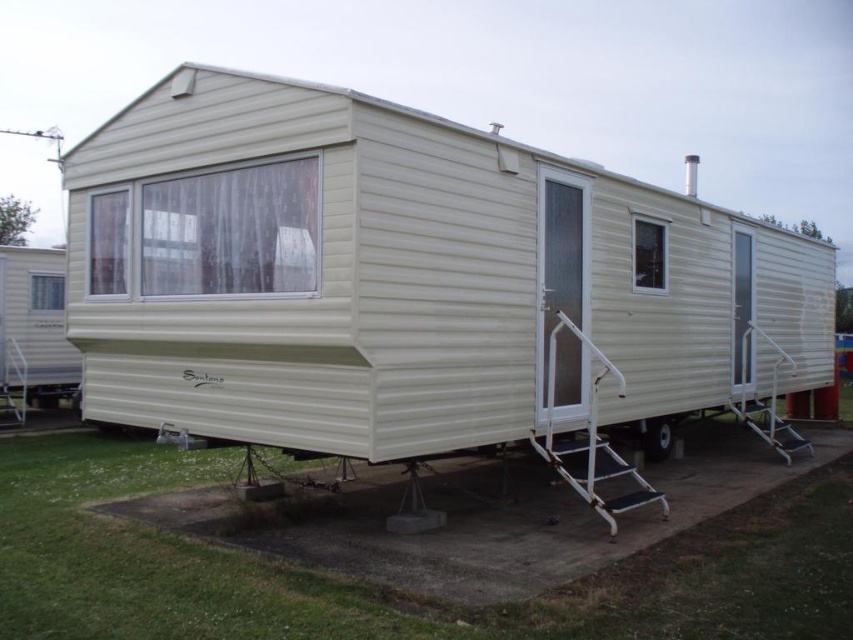
You are standing at the base of the mobile home and want to reach the entrance. There is a white plastic ladder at center at point (589,440). Can you use it to climb up to the entrance?

The white plastic ladder at center at point (589,440) is located at the center, so it can be used to climb up to the entrance.

Based on the photo, you are a delivery person trying to reach the front door of the mobile home. You have a white plastic ladder at center and a black rubber wheel at lower right. Which object is wider and can provide a more stable base for placing the ladder?

The white plastic ladder at center is wider than the black rubber wheel at lower right, so it can provide a more stable base for placing the ladder.